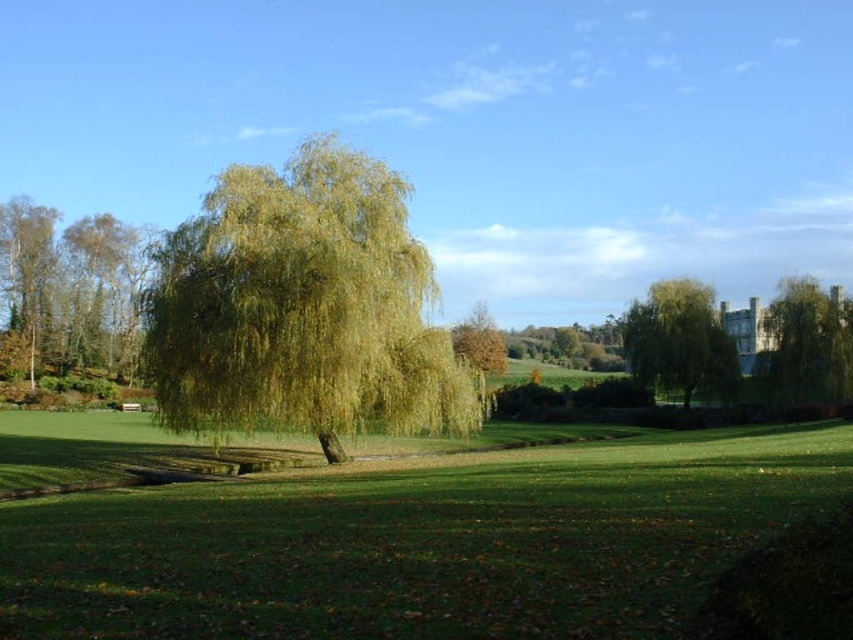
Question: Which object is the farthest from the green leafy willow at center?

Choices:
 (A) green leafy tree at center
 (B) brown leafy tree at left
 (C) brown leafy tree at center

Answer: (B)

Question: Which of the following is the closest to the observer?

Choices:
 (A) green leafy willow at center
 (B) green leafy tree at center

Answer: (A)

Question: Which object is positioned closest to the brown leafy tree at center?

Choices:
 (A) green leafy tree at right
 (B) green grass at center
 (C) brown leafy tree at left

Answer: (B)

Question: Does smooth silver birch at left appear over brown leafy tree at center?

Choices:
 (A) yes
 (B) no

Answer: (A)

Question: Observing the image, what is the correct spatial positioning of smooth silver birch at left in reference to brown leafy tree at center?

Choices:
 (A) below
 (B) above

Answer: (B)

Question: Does green leafy willow at center have a larger size compared to green leafy tree at right?

Choices:
 (A) yes
 (B) no

Answer: (A)